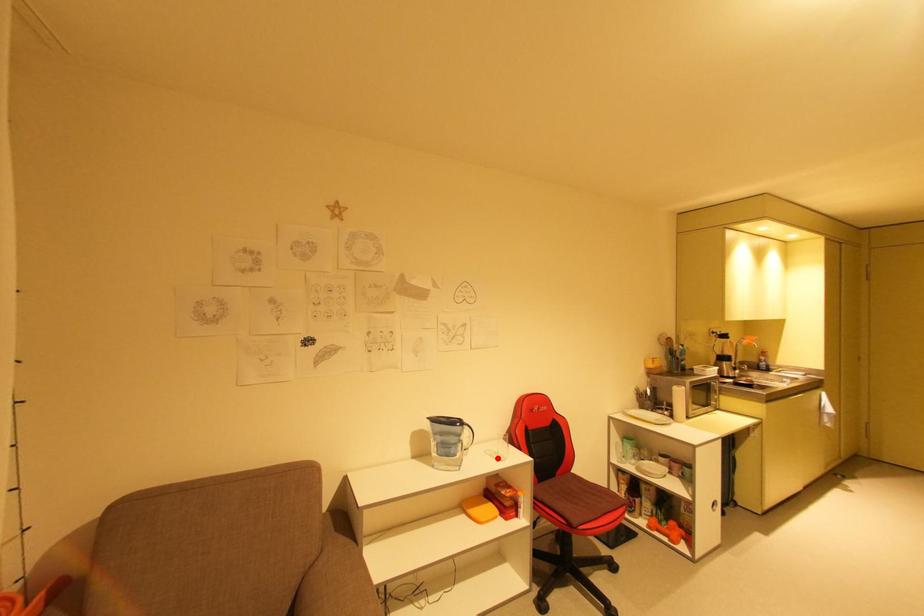
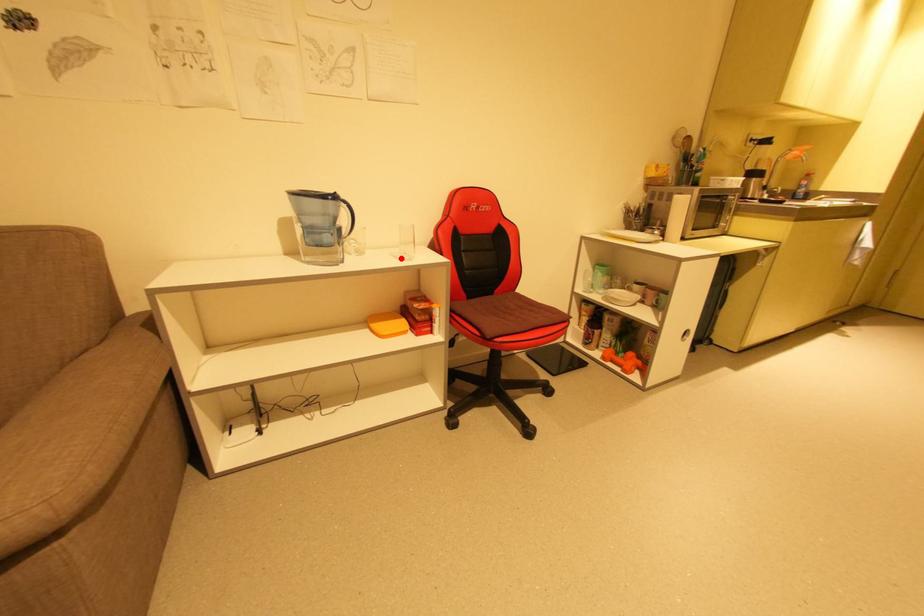
I am providing you with two images of the same scene from different viewpoints. A red point is marked on the first image and another point is marked on the second image. Are the points marked in image1 and image2 representing the same 3D position?

Yes